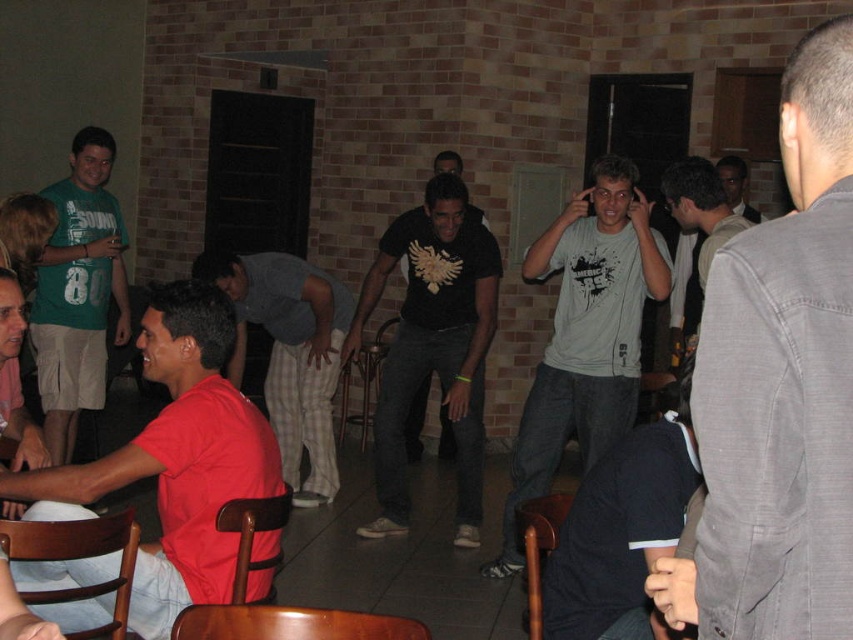
Question: Which of the following is the closest to the observer?

Choices:
 (A) gray matte t-shirt at center
 (B) metallic brown chair at center
 (C) matte red shirt at lower left

Answer: (C)

Question: Estimate the real-world distances between objects in this image. Which object is closer to the black matte t-shirt at center?

Choices:
 (A) gray cotton shirt at center
 (B) green t-shirt at left

Answer: (A)

Question: Does black matte t-shirt at center have a lesser width compared to wooden chair at lower center?

Choices:
 (A) yes
 (B) no

Answer: (B)

Question: Is dark gray fabric at lower right smaller than red matte shirt at center?

Choices:
 (A) no
 (B) yes

Answer: (B)

Question: Where is gray matte t-shirt at center located in relation to dark gray fabric at lower right in the image?

Choices:
 (A) right
 (B) left

Answer: (A)

Question: Which object appears farthest from the camera in this image?

Choices:
 (A) wooden chair at lower center
 (B) metallic brown chair at center

Answer: (B)